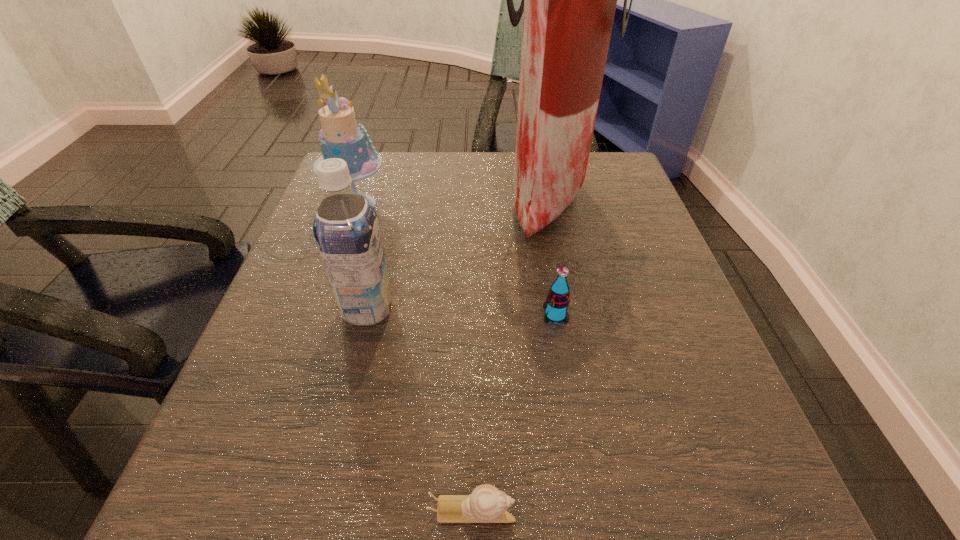
Where is `grocery bag`? grocery bag is located at coordinates (569, 0).

At what (x,y) coordinates should I click in order to perform the action: click on cake. Please return your answer as a coordinate pair (x, y). This screenshot has width=960, height=540. Looking at the image, I should click on (340, 137).

Identify the location of soya milk. The width and height of the screenshot is (960, 540). (346, 229).

Locate an element on the screen. the second shortest object is located at coordinates (557, 301).

Locate an element on the screen. the nearest object is located at coordinates (486, 504).

Image resolution: width=960 pixels, height=540 pixels. What are the coordinates of `the shortest object` in the screenshot? It's located at (486, 504).

Identify the location of free space located 0.260m on the front of the tallest object. This screenshot has height=540, width=960. (576, 345).

This screenshot has width=960, height=540. Identify the location of vacant space located 0.310m with a ladder on the side of the cake. (524, 205).

This screenshot has height=540, width=960. Identify the location of vacant space situated 0.240m on the label of the soya milk. (528, 309).

This screenshot has width=960, height=540. I want to click on vacant space located 0.070m on the left of the second shortest object, so click(x=503, y=315).